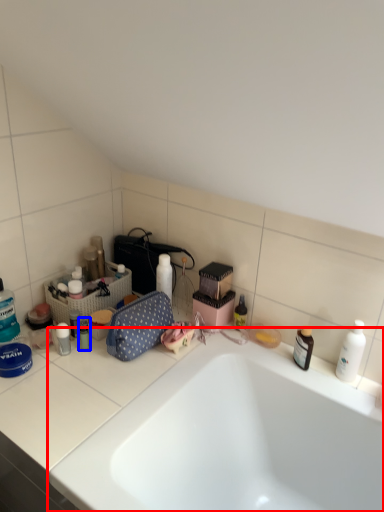
Question: Which object is further to the camera taking this photo, bathtub (highlighted by a red box) or toiletry (highlighted by a blue box)?

Choices:
 (A) bathtub
 (B) toiletry

Answer: (B)